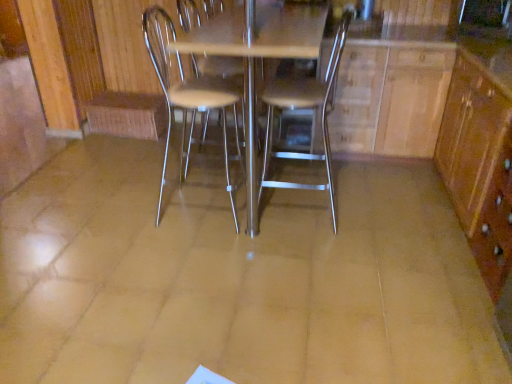
Question: Does brown wood/file cabinet at right have a lesser height compared to metallic silver chair at center, the 1th chair viewed from the right?

Choices:
 (A) yes
 (B) no

Answer: (A)

Question: Considering the relative sizes of brown wood/file cabinet at right and metallic silver chair at center, placed as the second chair when sorted from left to right, in the image provided, is brown wood/file cabinet at right smaller than metallic silver chair at center, placed as the second chair when sorted from left to right,?

Choices:
 (A) no
 (B) yes

Answer: (A)

Question: Is brown wood/file cabinet at right next to metallic silver chair at center, placed as the second chair when sorted from left to right?

Choices:
 (A) no
 (B) yes

Answer: (A)

Question: Does brown wood/file cabinet at right contain metallic silver chair at center, the 1th chair viewed from the right?

Choices:
 (A) no
 (B) yes

Answer: (A)

Question: From the image's perspective, is brown wood/file cabinet at right under metallic silver chair at center, placed as the second chair when sorted from left to right?

Choices:
 (A) yes
 (B) no

Answer: (A)

Question: Does brown wood/file cabinet at right turn towards metallic silver chair at center, placed as the second chair when sorted from left to right?

Choices:
 (A) yes
 (B) no

Answer: (A)

Question: Is brown wood/file cabinet at right closer to camera compared to metallic silver chair at center, the second chair viewed from the right?

Choices:
 (A) no
 (B) yes

Answer: (B)

Question: Considering the relative sizes of brown wood/file cabinet at right and metallic silver chair at center, the second chair viewed from the right, in the image provided, is brown wood/file cabinet at right shorter than metallic silver chair at center, the second chair viewed from the right,?

Choices:
 (A) no
 (B) yes

Answer: (B)

Question: Does brown wood/file cabinet at right have a larger size compared to metallic silver chair at center, the first chair when ordered from left to right?

Choices:
 (A) no
 (B) yes

Answer: (B)

Question: Is brown wood/file cabinet at right looking in the opposite direction of metallic silver chair at center, the second chair viewed from the right?

Choices:
 (A) no
 (B) yes

Answer: (A)

Question: Is brown wood/file cabinet at right outside metallic silver chair at center, the first chair when ordered from left to right?

Choices:
 (A) no
 (B) yes

Answer: (B)

Question: From a real-world perspective, is brown wood/file cabinet at right positioned under metallic silver chair at center, the first chair when ordered from left to right, based on gravity?

Choices:
 (A) no
 (B) yes

Answer: (B)

Question: Is wooden dresser at center not inside brown wood/file cabinet at right?

Choices:
 (A) yes
 (B) no

Answer: (B)